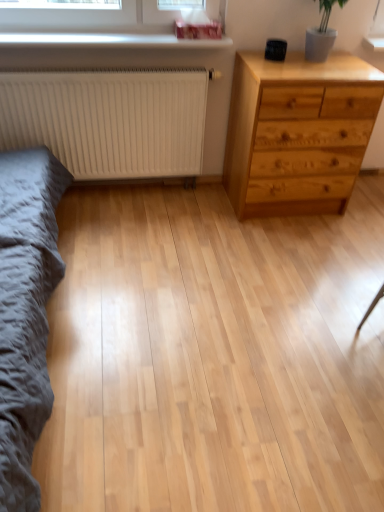
Image resolution: width=384 pixels, height=512 pixels. I want to click on blank space situated above white glossy window sill at upper center (from a real-world perspective), so click(x=105, y=33).